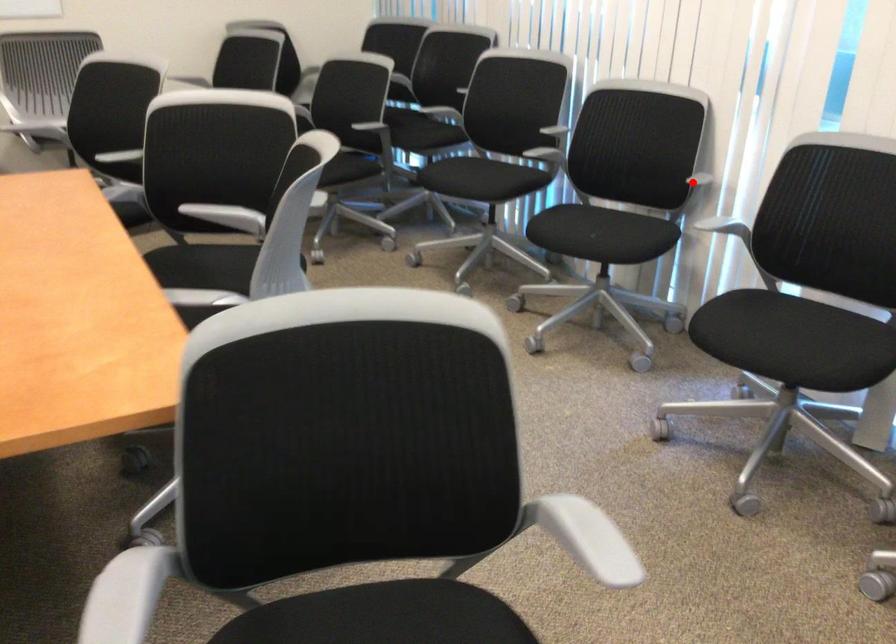
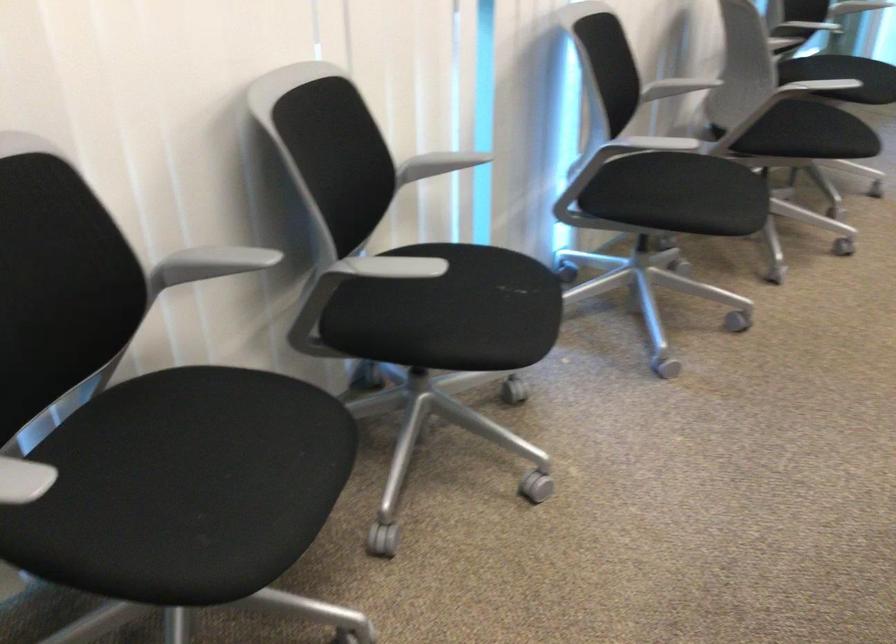
Question: I am providing you with two images of the same scene from different viewpoints. In image1, a red point is highlighted. Considering the same 3D point in image2, which of the following is correct?

Choices:
 (A) It is closer
 (B) It is farther

Answer: (A)